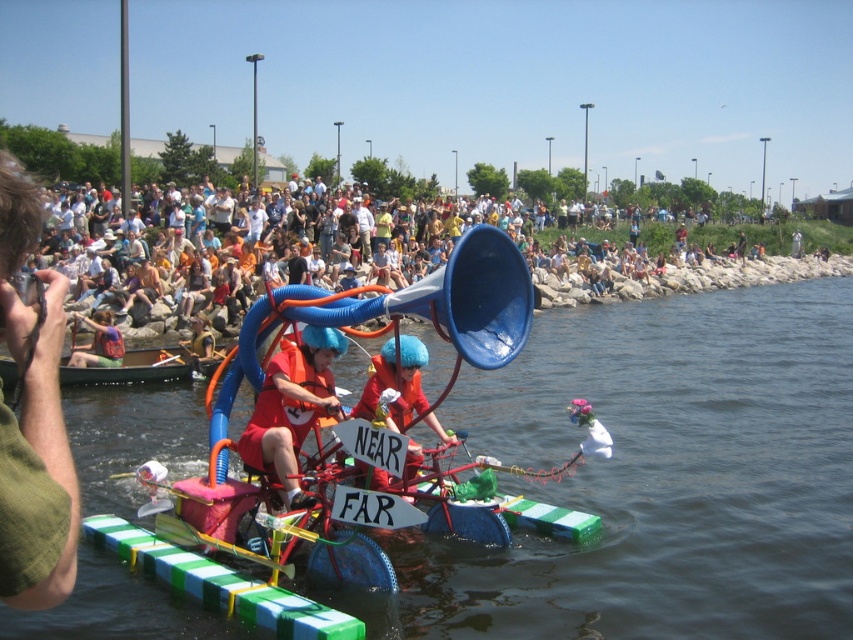
You are a photographer standing on the rocky shoreline. You want to take a photo of the green plastic boat at center and the red fabric shirt at center in the same frame. Based on their positions, which one should you focus on first to ensure both are in focus?

The green plastic boat at center is below the red fabric shirt at center. To ensure both are in focus, you should focus on the red fabric shirt at center first since it is closer to the photographer, and the boat will naturally be in the depth of field if focused on the foreground object.

You are a participant in the event and need to decide which object to grab first. The green plastic boat at center and the red fabric life vest at center are both in your path. Which one is taller, and why?

The green plastic boat at center is taller than the red fabric life vest at center, so you should grab the boat first if you need to reach a higher object.

Looking at the community event scene, where is the green plastic boat at center in relation to the red fabric shirt at center?

The green plastic boat at center is to the right of the red fabric shirt at center.